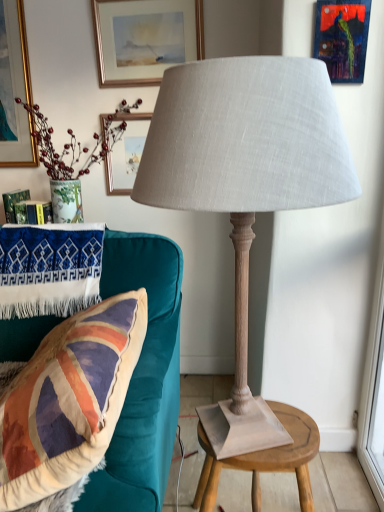
Question: From a real-world perspective, is matte gold picture frame at upper center, placed as the 2th picture frame when sorted from bottom to top, positioned over velvet union jack pillow at left based on gravity?

Choices:
 (A) no
 (B) yes

Answer: (B)

Question: From the image's perspective, is matte gold picture frame at upper center, which is counted as the first picture frame, starting from the top, under velvet union jack pillow at left?

Choices:
 (A) no
 (B) yes

Answer: (A)

Question: Are matte gold picture frame at upper center, the 1th picture frame when ordered from back to front, and velvet union jack pillow at left located far from each other?

Choices:
 (A) yes
 (B) no

Answer: (A)

Question: Can you confirm if matte gold picture frame at upper center, which is counted as the first picture frame, starting from the top, is positioned to the right of velvet union jack pillow at left?

Choices:
 (A) yes
 (B) no

Answer: (A)

Question: Could you tell me if matte gold picture frame at upper center, placed as the 2th picture frame when sorted from bottom to top, is facing velvet union jack pillow at left?

Choices:
 (A) no
 (B) yes

Answer: (A)

Question: Is metallic blue painting at upper right, which ranks as the first picture frame in right-to-left order, situated inside matte gray fabric lamp at center or outside?

Choices:
 (A) outside
 (B) inside

Answer: (A)

Question: From the image's perspective, is metallic blue painting at upper right, arranged as the second picture frame when viewed from the top, positioned above or below matte gray fabric lamp at center?

Choices:
 (A) above
 (B) below

Answer: (A)

Question: Would you say metallic blue painting at upper right, the 1th picture frame positioned from the front, is to the left or to the right of matte gray fabric lamp at center in the picture?

Choices:
 (A) left
 (B) right

Answer: (B)

Question: Considering the positions of metallic blue painting at upper right, arranged as the second picture frame when viewed from the top, and matte gray fabric lamp at center in the image, is metallic blue painting at upper right, arranged as the second picture frame when viewed from the top, wider or thinner than matte gray fabric lamp at center?

Choices:
 (A) wide
 (B) thin

Answer: (B)

Question: From a real-world perspective, is transparent glass window screen at right positioned above or below velvet union jack pillow at left?

Choices:
 (A) below
 (B) above

Answer: (A)

Question: Is transparent glass window screen at right bigger or smaller than velvet union jack pillow at left?

Choices:
 (A) small
 (B) big

Answer: (A)

Question: Visually, is transparent glass window screen at right positioned to the left or to the right of velvet union jack pillow at left?

Choices:
 (A) left
 (B) right

Answer: (B)

Question: Relative to velvet union jack pillow at left, is transparent glass window screen at right in front or behind?

Choices:
 (A) behind
 (B) front

Answer: (A)

Question: Is point (193, 13) positioned closer to the camera than point (29, 476)?

Choices:
 (A) farther
 (B) closer

Answer: (A)

Question: Relative to velvet union jack pillow at left, is matte gold picture frame at upper center, arranged as the 1th picture frame when viewed from the left, in front or behind?

Choices:
 (A) front
 (B) behind

Answer: (B)